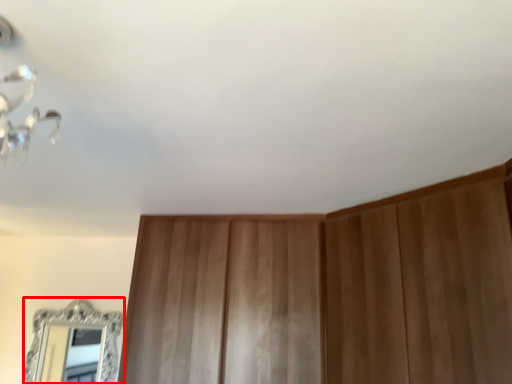
Question: Considering the relative positions of mirror (annotated by the red box) and dresser in the image provided, where is mirror (annotated by the red box) located with respect to the staircase?

Choices:
 (A) right
 (B) left

Answer: (B)